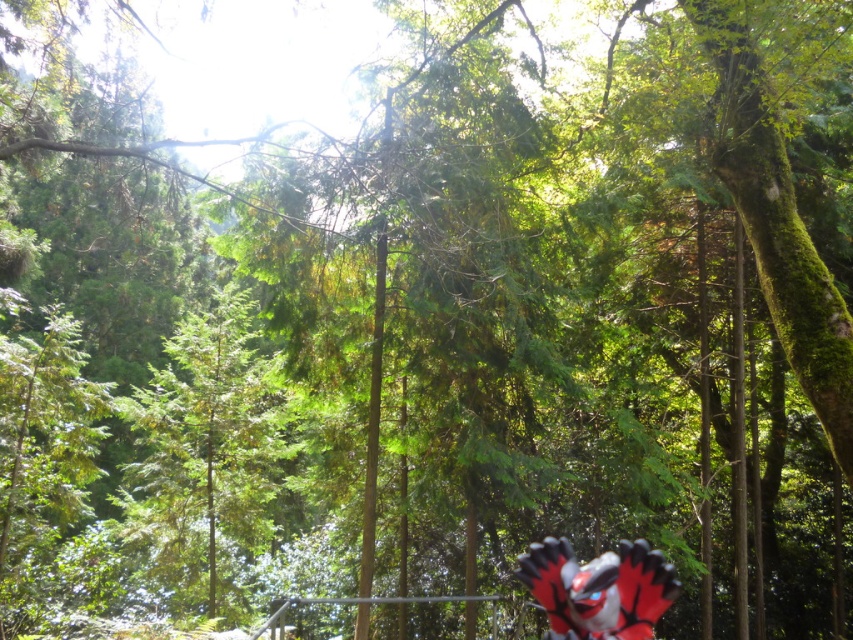
Based on the scene description, where is the green textured tree located in relation to the point marked at coordinates (x=204, y=454)?

The green textured tree at center is marked by the point at coordinates (x=204, y=454).

You are a hiker who has stumbled upon this forest scene. You notice the green textured tree at center and the red and black plush toy at bottom right. Which object takes up more area in the image?

The red and black plush toy at bottom right takes up more area in the image than the green textured tree at center, as the tree occupies less space.